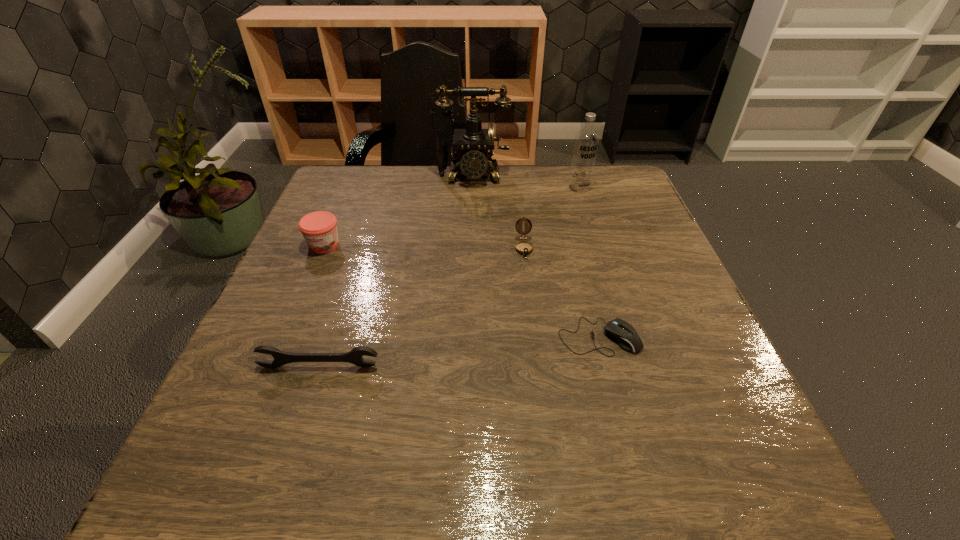
Locate an element on the screen. vacant space at the far edge of the desktop is located at coordinates (554, 204).

The width and height of the screenshot is (960, 540). Find the location of `free space at the near edge`. free space at the near edge is located at coordinates (503, 492).

This screenshot has height=540, width=960. Find the location of `free space at the left edge of the desktop`. free space at the left edge of the desktop is located at coordinates (252, 399).

Find the location of a particular element. vacant space at the right edge of the desktop is located at coordinates (653, 266).

Locate an element on the screen. vacant space at the far left corner is located at coordinates (357, 204).

In the image, there is a desktop. Identify the location of blank space at the far right corner. (609, 170).

Locate an element on the screen. The width and height of the screenshot is (960, 540). free spot between the compass and the jam is located at coordinates (424, 246).

The width and height of the screenshot is (960, 540). Find the location of `vacant region between the second nearest object and the compass`. vacant region between the second nearest object and the compass is located at coordinates (562, 292).

Where is `free space between the compass and the nearest object`? The height and width of the screenshot is (540, 960). free space between the compass and the nearest object is located at coordinates (421, 307).

I want to click on vacant area that lies between the fourth shortest object and the fifth farthest object, so click(462, 291).